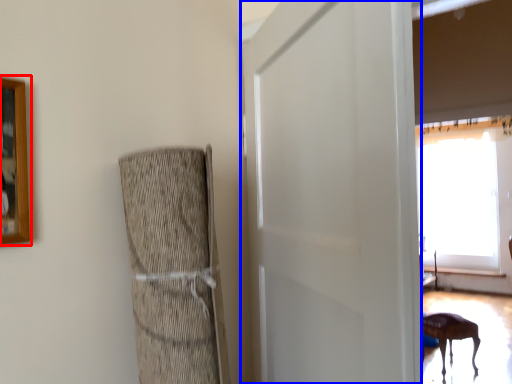
Question: Among these objects, which one is nearest to the camera, picture frame (highlighted by a red box) or screen door (highlighted by a blue box)?

Choices:
 (A) picture frame
 (B) screen door

Answer: (B)